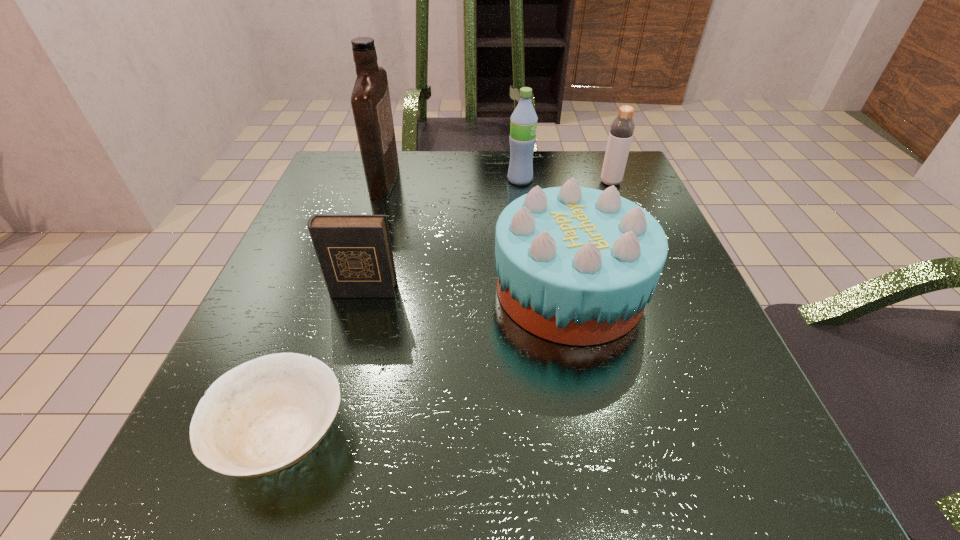
Locate an element on the screen. The width and height of the screenshot is (960, 540). liquor is located at coordinates (370, 100).

What are the coordinates of `the second tallest object` in the screenshot? It's located at (523, 126).

Image resolution: width=960 pixels, height=540 pixels. In order to click on bottle in this screenshot , I will do `click(622, 128)`.

The image size is (960, 540). I want to click on cake, so click(x=575, y=265).

You are a GUI agent. You are given a task and a screenshot of the screen. Output one action in this format:
    pyautogui.click(x=<x>, y=<y>)
    Task: Click on the diary
    Image resolution: width=960 pixels, height=540 pixels.
    Given the screenshot: What is the action you would take?
    point(355,254)

At what (x,y) coordinates should I click in order to perform the action: click on bowl. Please return your answer as a coordinate pair (x, y). Looking at the image, I should click on (264, 415).

Where is `the shortest object`? the shortest object is located at coordinates (264, 415).

I want to click on free region located on the label side of the tallest object, so click(x=560, y=179).

Find the location of a particular element. vacant space located 0.220m on the right of the water bottle is located at coordinates (630, 180).

Identify the location of free location located 0.330m on the front of the bottle. Image resolution: width=960 pixels, height=540 pixels. (656, 294).